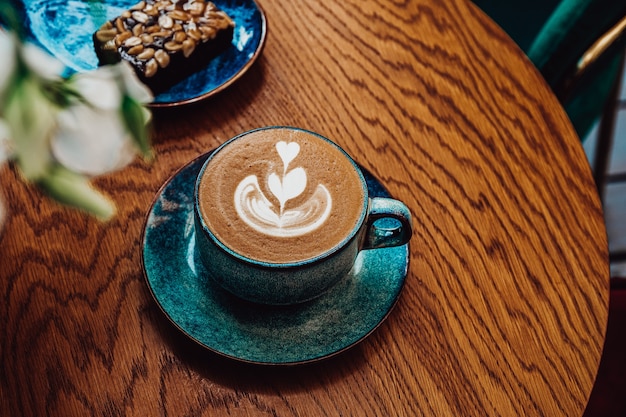
Identify the location of plate. (181, 298), (94, 26).